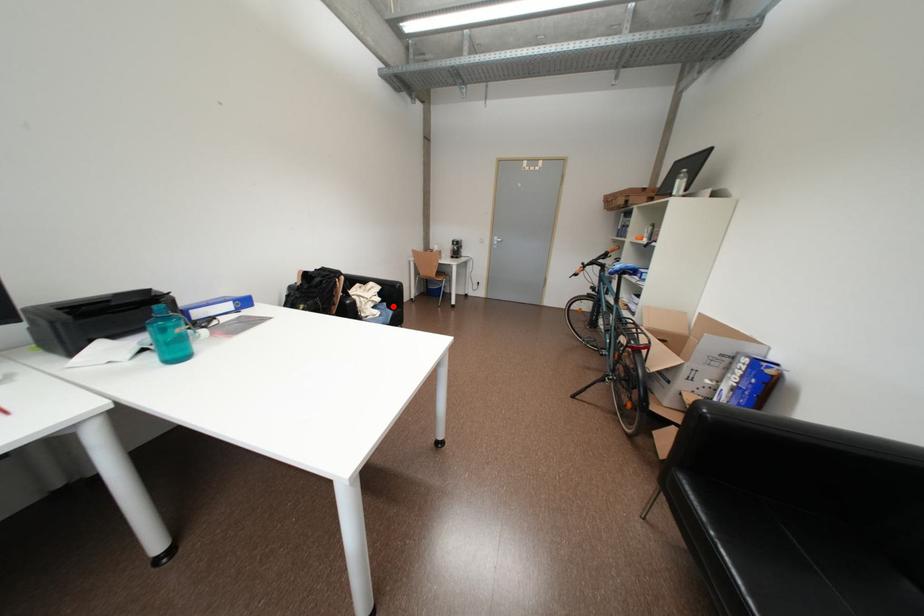
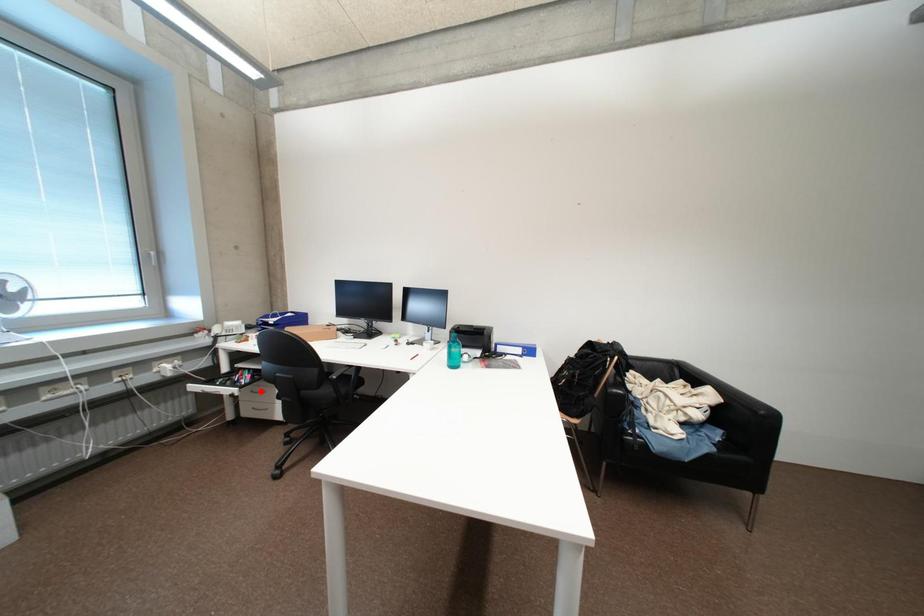
I am providing you with two images of the same scene from different viewpoints. A red point is marked on the first image and another point is marked on the second image. Do the highlighted points in image1 and image2 indicate the same real-world spot?

No